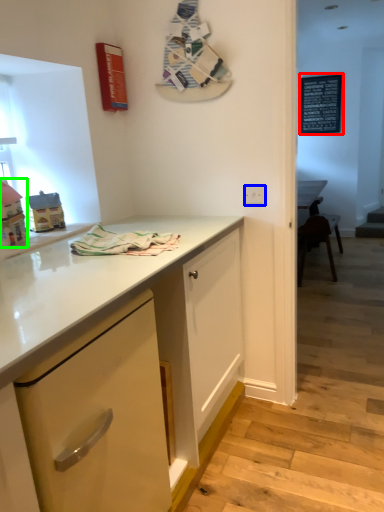
Question: Which object is positioned farthest from bulletin board (highlighted by a red box)? Select from electric outlet (highlighted by a blue box) and toy (highlighted by a green box).

Choices:
 (A) electric outlet
 (B) toy

Answer: (B)